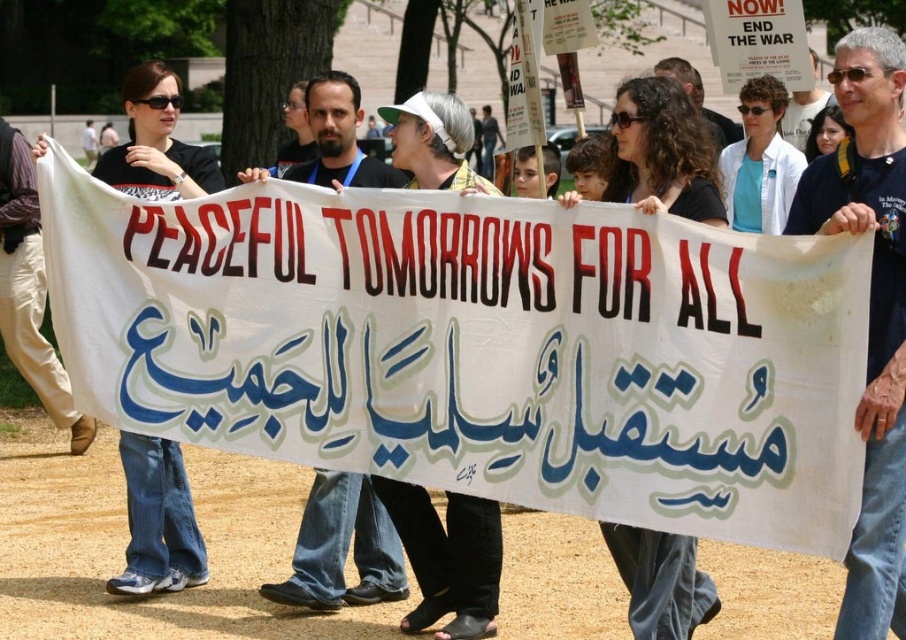
You are a photographer standing at the edge of the protest group. You want to capture a photo that includes both the gray hair at center and the matte black shirt at upper right. Given that your camera has a maximum focus range of 25 inches, will you be able to fit both subjects in the frame without moving closer?

The gray hair at center and the matte black shirt at upper right are 25.15 inches apart. Since the distance between them exceeds the camera maximum focus range of 25 inches, you will not be able to fit both subjects in the frame without moving closer.

You are a photographer trying to capture a photo of the protesters holding the banner. You want to ensure both the dark blue jeans at center and the matte black shirt at upper right are visible in the frame. Based on their positions, which direction should you move to include both in your shot?

Since the dark blue jeans at center is to the left of the matte black shirt at upper right, you should move to the left to ensure both the dark blue jeans at center and the matte black shirt at upper right are visible in the frame.